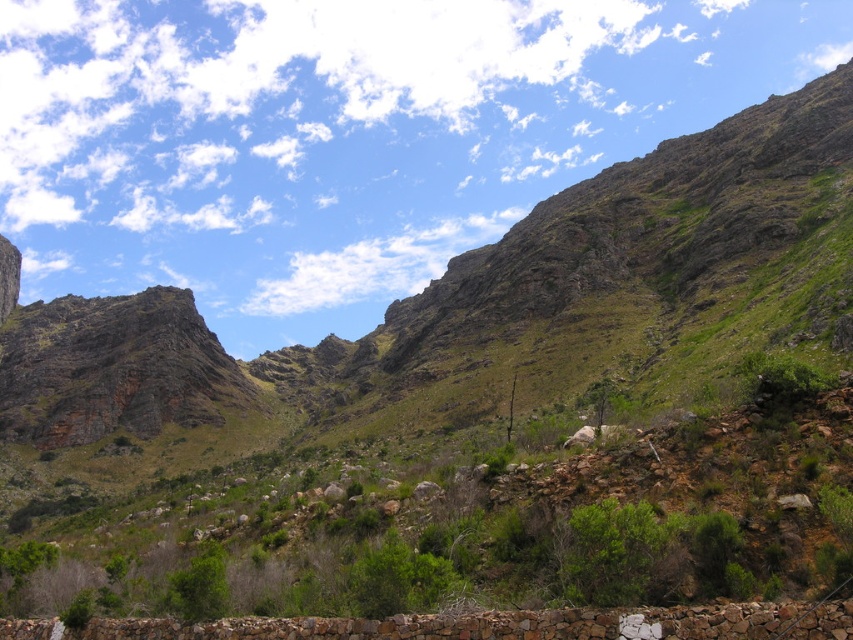
You are a hiker trying to navigate through the mountainous terrain. You notice the green leafy shrubs at center and the brown stone wall at lower center. Which object is positioned more to the east if the sun is shining from the west?

The green leafy shrubs at center is to the left of brown stone wall at lower center. Since the sun is coming from the west, the shadows would fall to the east. Therefore, the object casting a shadow towards the east would be the one positioned to the west. However, based on their spatial relationship, the green leafy shrubs at center being to the left of the brown stone wall at lower center would mean they are positioned more to the east if the wall is further west. Wait, this requires clarification. Let me

Based on the photo, you are a hiker standing at the starting point of a mountain trail. You see the green leafy shrubs at center in the distance. If your GPS says you need to reach the shrubs within 2 minutes, and you can walk at a steady pace of 3 feet per second, will you be able to reach them on time?

The green leafy shrubs at center is 89.04 feet away from camera. Since you walk at 3 feet per second, it would take you 89.04 divided by 3 equals 29.68 seconds, which is approximately 30 seconds. Therefore, you can reach the green leafy shrubs at center within 2 minutes.